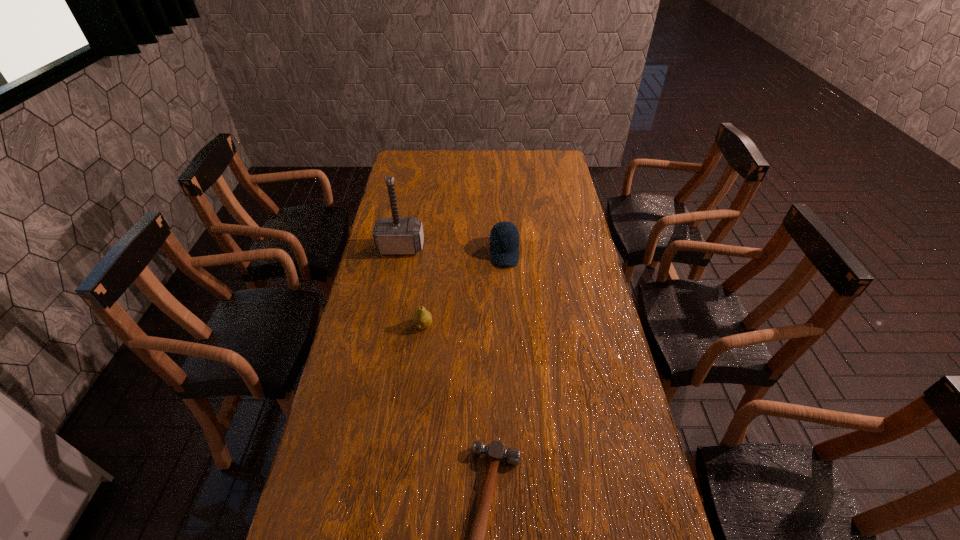
You are a GUI agent. You are given a task and a screenshot of the screen. Output one action in this format:
    pyautogui.click(x=<x>, y=<y>)
    Task: Click on the farther hammer
    The width and height of the screenshot is (960, 540).
    Given the screenshot: What is the action you would take?
    pyautogui.click(x=396, y=235)

Locate an element on the screen. This screenshot has height=540, width=960. the taller hammer is located at coordinates (396, 235).

The image size is (960, 540). I want to click on baseball cap, so click(504, 237).

You are a GUI agent. You are given a task and a screenshot of the screen. Output one action in this format:
    pyautogui.click(x=<x>, y=<y>)
    Task: Click on the pear
    
    Given the screenshot: What is the action you would take?
    (422, 318)

Identify the location of the third farthest object. (422, 318).

The width and height of the screenshot is (960, 540). What are the coordinates of `vacant space located 0.340m for striking with the head of the leftmost object` in the screenshot? It's located at (386, 325).

Image resolution: width=960 pixels, height=540 pixels. In order to click on vacant region located on the front-facing side of the baseball cap in this screenshot , I will do `click(511, 355)`.

Locate an element on the screen. The height and width of the screenshot is (540, 960). vacant space situated 0.380m on the front of the second object from left to right is located at coordinates (409, 445).

Image resolution: width=960 pixels, height=540 pixels. In order to click on object positioned at the left edge in this screenshot , I will do `click(396, 235)`.

At what (x,y) coordinates should I click in order to perform the action: click on vacant space at the far edge of the desktop. Please return your answer as a coordinate pair (x, y). The width and height of the screenshot is (960, 540). Looking at the image, I should click on coord(445,161).